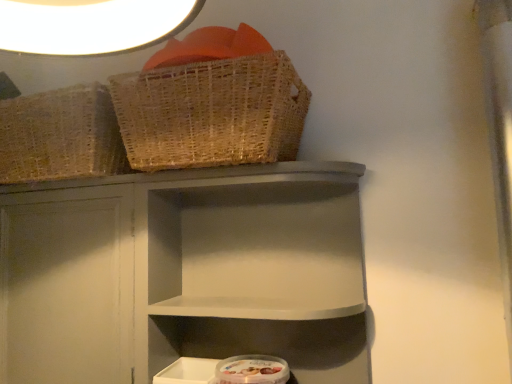
Question: Is point (131, 223) closer or farther from the camera than point (140, 153)?

Choices:
 (A) farther
 (B) closer

Answer: (A)

Question: Considering the positions of matte gray shelf at center and woven natural basket at upper center in the image, is matte gray shelf at center wider or thinner than woven natural basket at upper center?

Choices:
 (A) wide
 (B) thin

Answer: (B)

Question: Considering the positions of matte gray shelf at center and woven natural basket at upper center in the image, is matte gray shelf at center bigger or smaller than woven natural basket at upper center?

Choices:
 (A) big
 (B) small

Answer: (A)

Question: From the image's perspective, relative to matte gray shelf at center, is woven natural basket at upper center above or below?

Choices:
 (A) above
 (B) below

Answer: (A)

Question: Would you say woven natural basket at upper center is to the left or to the right of matte gray shelf at center in the picture?

Choices:
 (A) left
 (B) right

Answer: (A)

Question: In the image, is woven natural basket at upper center positioned in front of or behind matte gray shelf at center?

Choices:
 (A) front
 (B) behind

Answer: (A)

Question: In terms of height, does woven natural basket at upper center look taller or shorter compared to matte gray shelf at center?

Choices:
 (A) short
 (B) tall

Answer: (A)